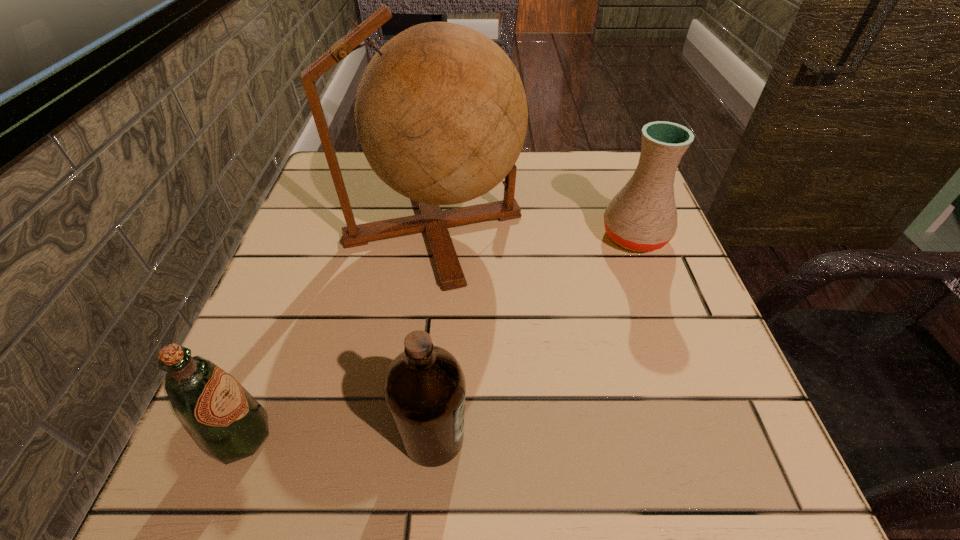
Find the location of a particular element. This screenshot has width=960, height=540. globe is located at coordinates (441, 114).

Find the location of `the rightmost object`. the rightmost object is located at coordinates pyautogui.click(x=642, y=216).

Where is `the right olive oil`? the right olive oil is located at coordinates [x=424, y=388].

Where is `the leftmost object`? The width and height of the screenshot is (960, 540). the leftmost object is located at coordinates pyautogui.click(x=228, y=424).

Locate an element on the screen. The image size is (960, 540). vacant space located on the surface of the tallest object is located at coordinates (665, 226).

Identify the location of vacant region located on the front of the pottery. (696, 401).

Identify the location of free space located on the label of the right olive oil. The image size is (960, 540). (627, 437).

I want to click on vacant space located 0.290m on the front-facing side of the leftmost object, so click(480, 436).

The height and width of the screenshot is (540, 960). Identify the location of object that is at the far edge. [441, 114].

Find the location of a particular element. globe positioned at the left edge is located at coordinates (441, 114).